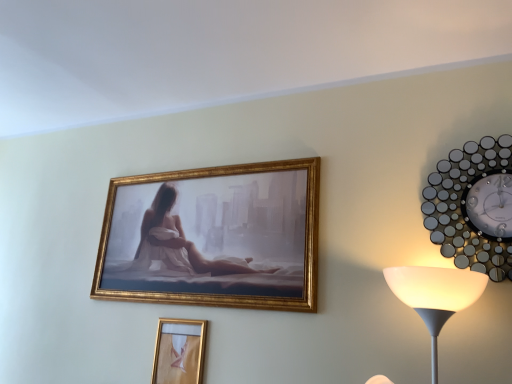
Question: In terms of size, does metallic silver wall clock at right appear bigger or smaller than gold metallic picture frame at lower center?

Choices:
 (A) small
 (B) big

Answer: (B)

Question: Is point (467, 246) positioned closer to the camera than point (202, 336)?

Choices:
 (A) closer
 (B) farther

Answer: (A)

Question: Looking at their shapes, would you say metallic silver wall clock at right is wider or thinner than gold metallic picture frame at lower center?

Choices:
 (A) wide
 (B) thin

Answer: (A)

Question: Is gold metallic picture frame at lower center spatially inside metallic silver wall clock at right, or outside of it?

Choices:
 (A) inside
 (B) outside

Answer: (B)

Question: Considering the positions of gold metallic picture frame at lower center and metallic silver wall clock at right in the image, is gold metallic picture frame at lower center bigger or smaller than metallic silver wall clock at right?

Choices:
 (A) big
 (B) small

Answer: (B)

Question: Is point (185, 337) positioned closer to the camera than point (476, 225)?

Choices:
 (A) closer
 (B) farther

Answer: (B)

Question: From a real-world perspective, is gold metallic picture frame at lower center above or below metallic silver wall clock at right?

Choices:
 (A) above
 (B) below

Answer: (B)